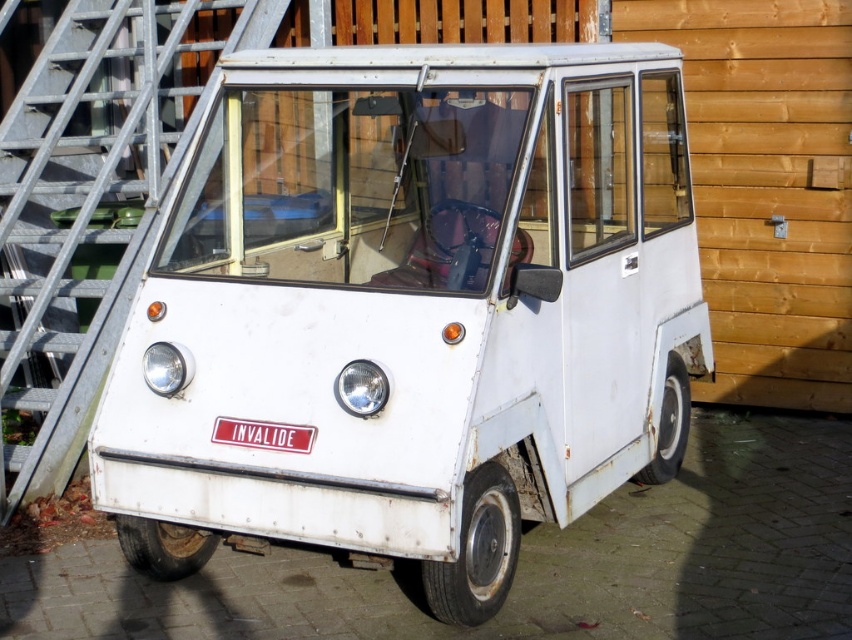
You are a delivery person trying to park your van next to a red rubber license plate at center. According to the scene, where should you position your white matte van at center relative to the license plate?

The white matte van at center should be positioned on the right side of the red rubber license plate at center as per the scene description.